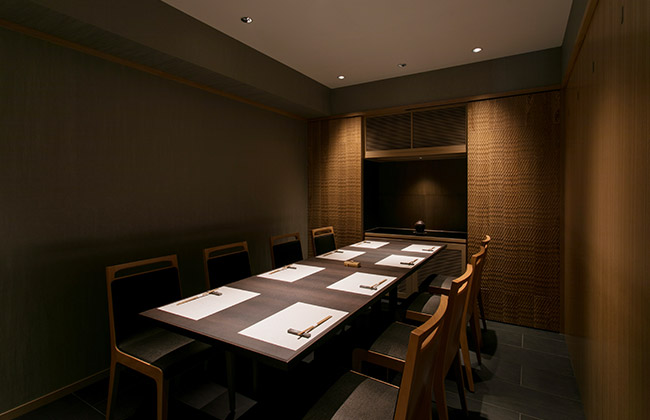
At what (x,y) coordinates should I click in order to perform the action: click on nearest chair in frame. Please return your answer as a coordinate pair (x, y). The image size is (650, 420). Looking at the image, I should click on (409, 372).